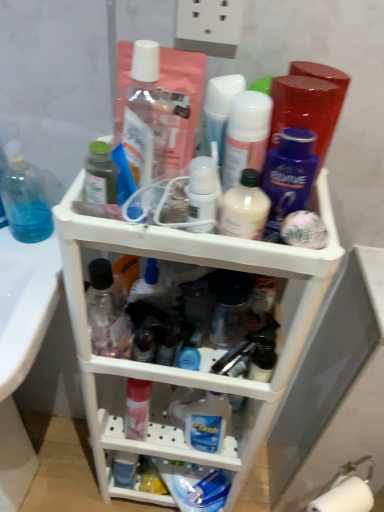
Locate an element on the screen. free space in front of transparent plastic hand soap at left is located at coordinates (24, 281).